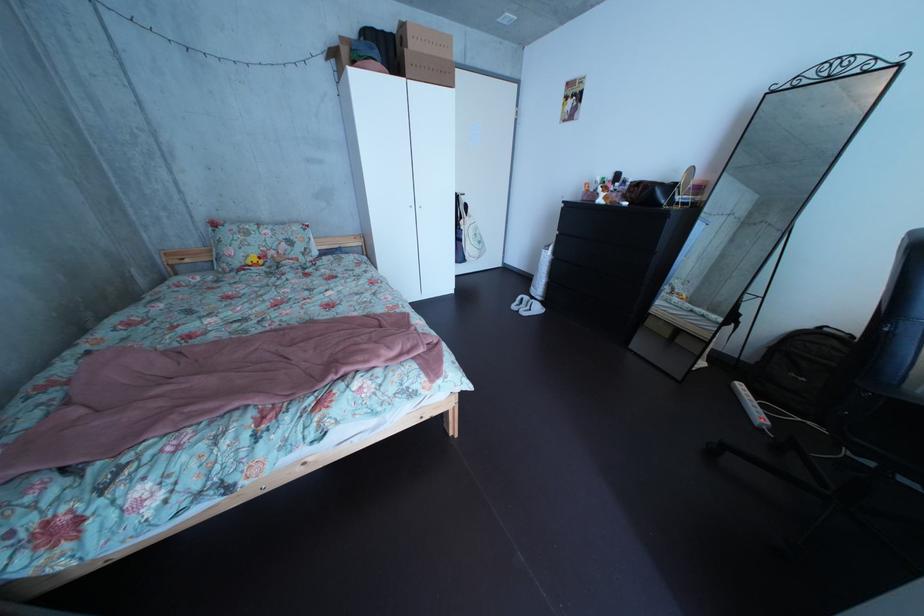
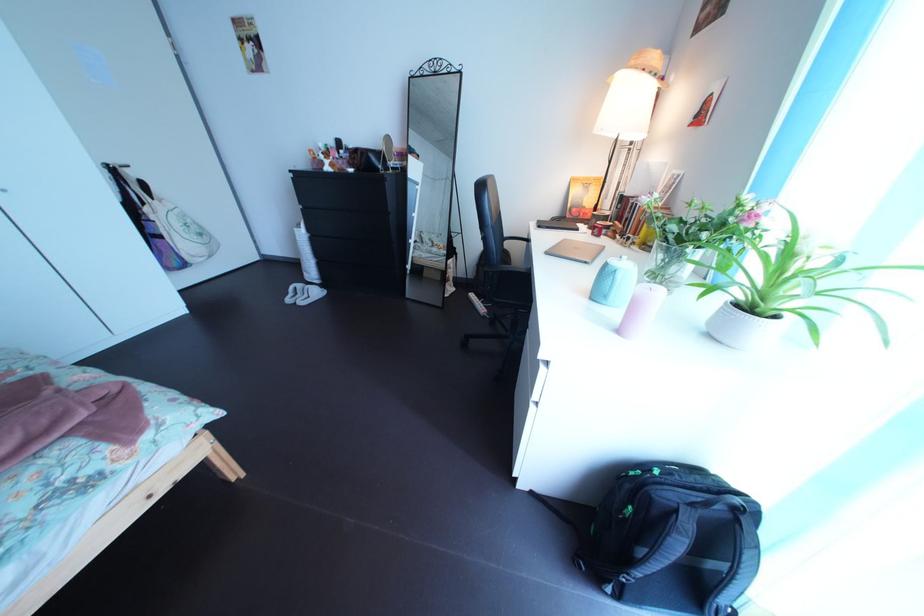
Question: The camera is either moving clockwise (left) or counter-clockwise (right) around the object. The first image is from the beginning of the video and the second image is from the end. Is the camera moving left or right when shooting the video?

Choices:
 (A) Left
 (B) Right

Answer: (A)